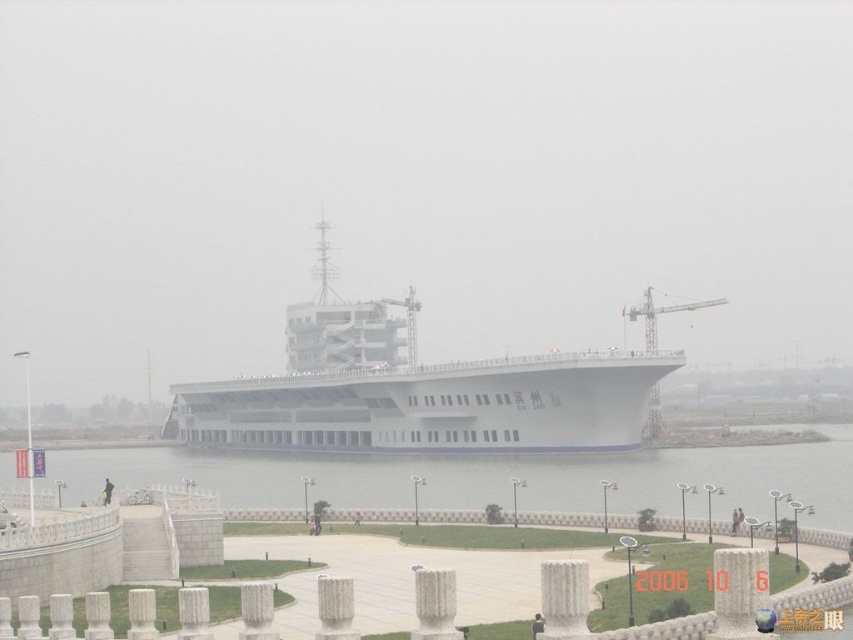
Question: Can you confirm if white matte aircraft carrier at center is positioned below clear water at lower center?

Choices:
 (A) no
 (B) yes

Answer: (A)

Question: Is white matte aircraft carrier at center to the left of clear water at lower center from the viewer's perspective?

Choices:
 (A) no
 (B) yes

Answer: (B)

Question: Which of the following is the closest to the observer?

Choices:
 (A) white matte aircraft carrier at center
 (B) clear water at lower center

Answer: (B)

Question: Can you confirm if white matte aircraft carrier at center is positioned below clear water at lower center?

Choices:
 (A) no
 (B) yes

Answer: (A)